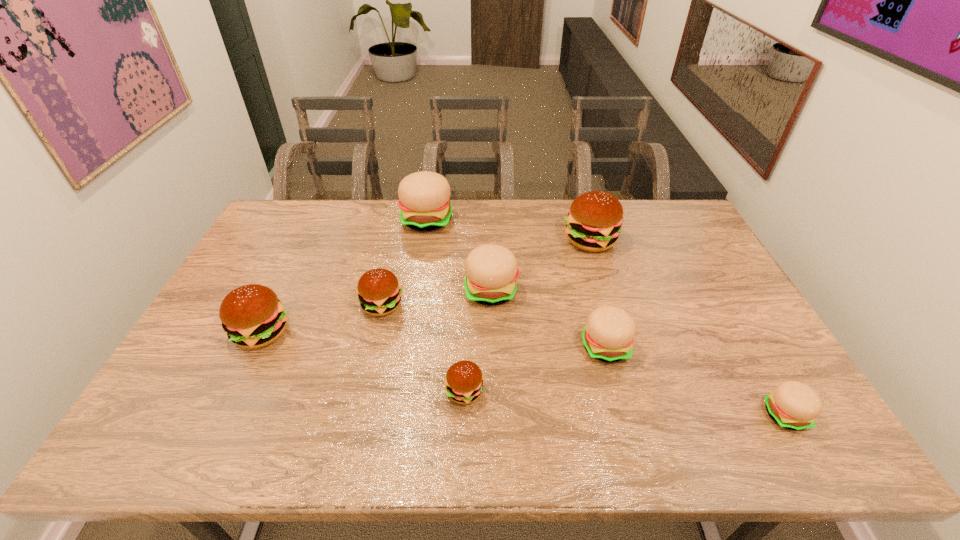
What are the coordinates of `free space at the right edge of the desktop` in the screenshot? It's located at (690, 263).

Where is `free space at the far right corner of the desktop`? The image size is (960, 540). free space at the far right corner of the desktop is located at coordinates (649, 218).

The image size is (960, 540). I want to click on free area in between the biggest brown hamburger and the third brown hamburger from left to right, so click(527, 316).

At what (x,y) coordinates should I click in order to perform the action: click on vacant region between the second biggest beige hamburger and the nearest brown hamburger. Please return your answer as a coordinate pair (x, y). This screenshot has width=960, height=540. Looking at the image, I should click on (478, 341).

Image resolution: width=960 pixels, height=540 pixels. Identify the location of free space that is in between the third farthest beige hamburger and the farthest brown hamburger. (597, 294).

This screenshot has height=540, width=960. What are the coordinates of `free space between the third brown hamburger from left to right and the rightmost brown hamburger` in the screenshot? It's located at (527, 316).

Locate an element on the screen. This screenshot has width=960, height=540. empty space that is in between the third nearest beige hamburger and the second nearest beige hamburger is located at coordinates (548, 319).

Locate an element on the screen. The width and height of the screenshot is (960, 540). free space between the second nearest beige hamburger and the third brown hamburger from right to left is located at coordinates (493, 326).

The width and height of the screenshot is (960, 540). Find the location of `vacant space in between the biggest brown hamburger and the third smallest beige hamburger`. vacant space in between the biggest brown hamburger and the third smallest beige hamburger is located at coordinates (540, 266).

I want to click on unoccupied position between the leftmost brown hamburger and the biggest beige hamburger, so click(x=345, y=276).